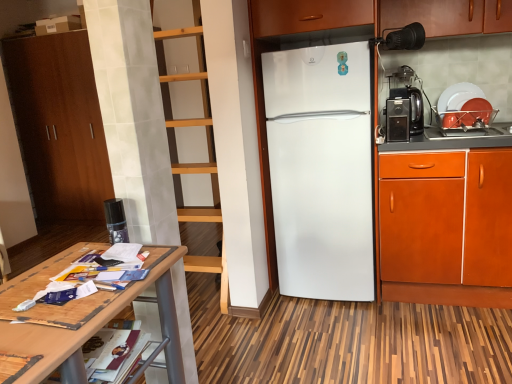
Locate an element on the screen. Image resolution: width=512 pixels, height=384 pixels. wooden table at lower left is located at coordinates (85, 314).

In order to click on white matte refrigerator at center in this screenshot , I will do `click(321, 169)`.

What is the approximate height of satin black spray can at left, arranged as the 1th appliance when viewed from the left?

satin black spray can at left, arranged as the 1th appliance when viewed from the left, is 5.93 inches in height.

The height and width of the screenshot is (384, 512). I want to click on orange wood cabinet at right, positioned as the first cabinetry in front-to-back order, so click(446, 227).

Describe the element at coordinates (446, 227) in the screenshot. This screenshot has height=384, width=512. I see `orange wood cabinet at right, the second cabinetry viewed from the back` at that location.

This screenshot has width=512, height=384. I want to click on black plastic toaster at right, which is the 2th appliance from bottom to top, so click(397, 120).

What is the approximate height of black plastic toaster at right, which is the 2th appliance in front-to-back order?

8.45 inches.

In order to click on wooden table at lower left in this screenshot , I will do `click(85, 314)`.

Based on the photo, would you say white matte refrigerator at center is a long distance from black plastic coffee machine at right?

No, white matte refrigerator at center is in close proximity to black plastic coffee machine at right.

What's the angular difference between white matte refrigerator at center and black plastic coffee machine at right's facing directions?

white matte refrigerator at center and black plastic coffee machine at right are facing 4.01e-05 degrees away from each other.

Considering the sizes of objects white matte refrigerator at center and black plastic coffee machine at right in the image provided, who is taller, white matte refrigerator at center or black plastic coffee machine at right?

Standing taller between the two is white matte refrigerator at center.

Which object is thinner, white matte refrigerator at center or black plastic coffee machine at right?

With smaller width is black plastic coffee machine at right.

From the picture: Is orange wood cabinet at right, arranged as the 1th cabinetry when viewed from the right, thinner than black plastic toaster at right, which is the 2th appliance from bottom to top?

No.

How distant is orange wood cabinet at right, arranged as the 1th cabinetry when viewed from the right, from black plastic toaster at right, which appears as the 2th appliance when viewed from the right?

A distance of 18.83 inches exists between orange wood cabinet at right, arranged as the 1th cabinetry when viewed from the right, and black plastic toaster at right, which appears as the 2th appliance when viewed from the right.

Is orange wood cabinet at right, positioned as the first cabinetry in front-to-back order, bigger or smaller than black plastic toaster at right, the 2th appliance from the back?

orange wood cabinet at right, positioned as the first cabinetry in front-to-back order, is bigger than black plastic toaster at right, the 2th appliance from the back.

Which is less distant, (437,166) or (398,100)?

The point (437,166) is in front.

Between brown wood cabinet at left, positioned as the first cabinetry in back-to-front order, and orange wood cabinet at right, which is counted as the 2th cabinetry, starting from the left, which one is positioned in front?

orange wood cabinet at right, which is counted as the 2th cabinetry, starting from the left, is more forward.

From a real-world perspective, which is physically below, brown wood cabinet at left, positioned as the first cabinetry in back-to-front order, or orange wood cabinet at right, arranged as the 1th cabinetry when viewed from the right?

orange wood cabinet at right, arranged as the 1th cabinetry when viewed from the right, from a real-world perspective.

From the image's perspective, which is below, brown wood cabinet at left, positioned as the first cabinetry in back-to-front order, or orange wood cabinet at right, the second cabinetry viewed from the back?

From the image's view, orange wood cabinet at right, the second cabinetry viewed from the back, is below.

Considering the positions of objects brown wood cabinet at left, which is counted as the 2th cabinetry, starting from the right, and orange wood cabinet at right, arranged as the 1th cabinetry when viewed from the right, in the image provided, who is more to the right, brown wood cabinet at left, which is counted as the 2th cabinetry, starting from the right, or orange wood cabinet at right, arranged as the 1th cabinetry when viewed from the right,?

Positioned to the right is orange wood cabinet at right, arranged as the 1th cabinetry when viewed from the right.

Considering their positions, is black plastic toaster at right, the 2th appliance from the top, located in front of or behind white glossy plate at upper right, which is counted as the first appliance, starting from the right?

In the image, black plastic toaster at right, the 2th appliance from the top, appears in front of white glossy plate at upper right, which is counted as the first appliance, starting from the right.

Locate an element on the screen. The image size is (512, 384). appliance that is the 1st one when counting leftward from the white glossy plate at upper right, the first appliance from the top is located at coordinates (397, 120).

Is black plastic toaster at right, the 2th appliance from the back, positioned far away from white glossy plate at upper right, the third appliance from the bottom?

No, black plastic toaster at right, the 2th appliance from the back, is in close proximity to white glossy plate at upper right, the third appliance from the bottom.

Does black plastic toaster at right, marked as the second appliance in a left-to-right arrangement, turn towards white glossy plate at upper right, which appears as the 1th appliance when viewed from the back?

Answer: No, black plastic toaster at right, marked as the second appliance in a left-to-right arrangement, is not turned towards white glossy plate at upper right, which appears as the 1th appliance when viewed from the back.

Is satin black spray can at left, the third appliance when ordered from top to bottom, at the back of black plastic toaster at right, the 2th appliance from the top?

black plastic toaster at right, the 2th appliance from the top, does not have its back to satin black spray can at left, the third appliance when ordered from top to bottom.

Could you measure the distance between black plastic toaster at right, the 2th appliance from the back, and satin black spray can at left, placed as the first appliance when sorted from bottom to top?

black plastic toaster at right, the 2th appliance from the back, and satin black spray can at left, placed as the first appliance when sorted from bottom to top, are 1.43 meters apart.

Image resolution: width=512 pixels, height=384 pixels. In the image, there is a black plastic toaster at right, the 2th appliance from the top. What are the coordinates of `appliance below it (from the image's perspective)` in the screenshot? It's located at (116, 221).

Is black plastic toaster at right, which is the 2th appliance from bottom to top, positioned far away from satin black spray can at left, arranged as the first appliance when viewed from the front?

Yes, black plastic toaster at right, which is the 2th appliance from bottom to top, and satin black spray can at left, arranged as the first appliance when viewed from the front, are quite far apart.

From the picture: Who is more distant, white matte refrigerator at center or white glossy plate at upper right, the third appliance viewed from the front?

Positioned behind is white glossy plate at upper right, the third appliance viewed from the front.

Locate an element on the screen. Image resolution: width=512 pixels, height=384 pixels. refrigerator on the left side of white glossy plate at upper right, the first appliance from the top is located at coordinates (321, 169).

Is white matte refrigerator at center completely or partially outside of white glossy plate at upper right, the first appliance from the top?

Yes, white matte refrigerator at center is located beyond the bounds of white glossy plate at upper right, the first appliance from the top.

Does white matte refrigerator at center have a larger size compared to white glossy plate at upper right, which is counted as the first appliance, starting from the right?

Indeed, white matte refrigerator at center has a larger size compared to white glossy plate at upper right, which is counted as the first appliance, starting from the right.

Locate an element on the screen. This screenshot has height=384, width=512. cabinetry on the left of black plastic toaster at right, the 2th appliance from the back is located at coordinates (59, 125).

Which object is positioned more to the right, black plastic toaster at right, which is the 2th appliance from bottom to top, or brown wood cabinet at left, which is counted as the 2th cabinetry, starting from the right?

black plastic toaster at right, which is the 2th appliance from bottom to top, is more to the right.

Between black plastic toaster at right, which appears as the 2th appliance when viewed from the right, and brown wood cabinet at left, positioned as the first cabinetry in back-to-front order, which one has smaller size?

black plastic toaster at right, which appears as the 2th appliance when viewed from the right.

Find the location of `coffee machine lying above the white matte refrigerator at center (from the image's perspective)`. coffee machine lying above the white matte refrigerator at center (from the image's perspective) is located at coordinates (404, 114).

This screenshot has width=512, height=384. Find the location of `the 1st appliance to the left of the orange wood cabinet at right, positioned as the first cabinetry in front-to-back order, counting from the anchor's position`. the 1st appliance to the left of the orange wood cabinet at right, positioned as the first cabinetry in front-to-back order, counting from the anchor's position is located at coordinates (397, 120).

When comparing their distances from black plastic coffee machine at right, does satin black spray can at left, placed as the first appliance when sorted from bottom to top, or white glossy plate at upper right, which appears as the 1th appliance when viewed from the back, seem closer?

white glossy plate at upper right, which appears as the 1th appliance when viewed from the back, lies closer to black plastic coffee machine at right than the other object.

Based on their spatial positions, is white glossy plate at upper right, the third appliance viewed from the front, or white matte refrigerator at center closer to satin black spray can at left, placed as the first appliance when sorted from bottom to top?

white matte refrigerator at center lies closer to satin black spray can at left, placed as the first appliance when sorted from bottom to top, than the other object.

Considering their positions, is black plastic coffee machine at right positioned further to wooden table at lower left than white glossy plate at upper right, the third appliance viewed from the front?

The object further to wooden table at lower left is white glossy plate at upper right, the third appliance viewed from the front.

Based on the photo, based on their spatial positions, is black plastic coffee machine at right or wooden table at lower left closer to orange wood cabinet at right, the second cabinetry viewed from the back?

The object closer to orange wood cabinet at right, the second cabinetry viewed from the back, is black plastic coffee machine at right.

From the picture: Estimate the real-world distances between objects in this image. Which object is closer to brown wood cabinet at left, acting as the first cabinetry starting from the left, satin black spray can at left, the third appliance when ordered from top to bottom, or black plastic coffee machine at right?

The object closer to brown wood cabinet at left, acting as the first cabinetry starting from the left, is satin black spray can at left, the third appliance when ordered from top to bottom.

Estimate the real-world distances between objects in this image. Which object is further from black plastic toaster at right, the 2th appliance from the back, brown wood cabinet at left, which is counted as the 2th cabinetry, starting from the right, or wooden table at lower left?

brown wood cabinet at left, which is counted as the 2th cabinetry, starting from the right.

Estimate the real-world distances between objects in this image. Which object is further from black plastic toaster at right, which appears as the 2th appliance when viewed from the right, white matte refrigerator at center or satin black spray can at left, arranged as the third appliance when viewed from the right?

satin black spray can at left, arranged as the third appliance when viewed from the right, lies further to black plastic toaster at right, which appears as the 2th appliance when viewed from the right, than the other object.

Considering their positions, is white glossy plate at upper right, the third appliance in the left-to-right sequence, positioned further to orange wood cabinet at right, which is counted as the 2th cabinetry, starting from the left, than black plastic coffee machine at right?

white glossy plate at upper right, the third appliance in the left-to-right sequence, lies further to orange wood cabinet at right, which is counted as the 2th cabinetry, starting from the left, than the other object.

This screenshot has width=512, height=384. In order to click on refrigerator located between wooden table at lower left and orange wood cabinet at right, the second cabinetry viewed from the back, in the left-right direction in this screenshot , I will do `click(321, 169)`.

Image resolution: width=512 pixels, height=384 pixels. I want to click on appliance between satin black spray can at left, arranged as the third appliance when viewed from the right, and orange wood cabinet at right, arranged as the 1th cabinetry when viewed from the right, in the horizontal direction, so click(397, 120).

Find the location of a particular element. The image size is (512, 384). coffee machine between white matte refrigerator at center and orange wood cabinet at right, arranged as the 1th cabinetry when viewed from the right is located at coordinates (404, 114).

The height and width of the screenshot is (384, 512). What are the coordinates of `refrigerator between satin black spray can at left, arranged as the 1th appliance when viewed from the left, and black plastic coffee machine at right, in the horizontal direction` in the screenshot? It's located at (321, 169).